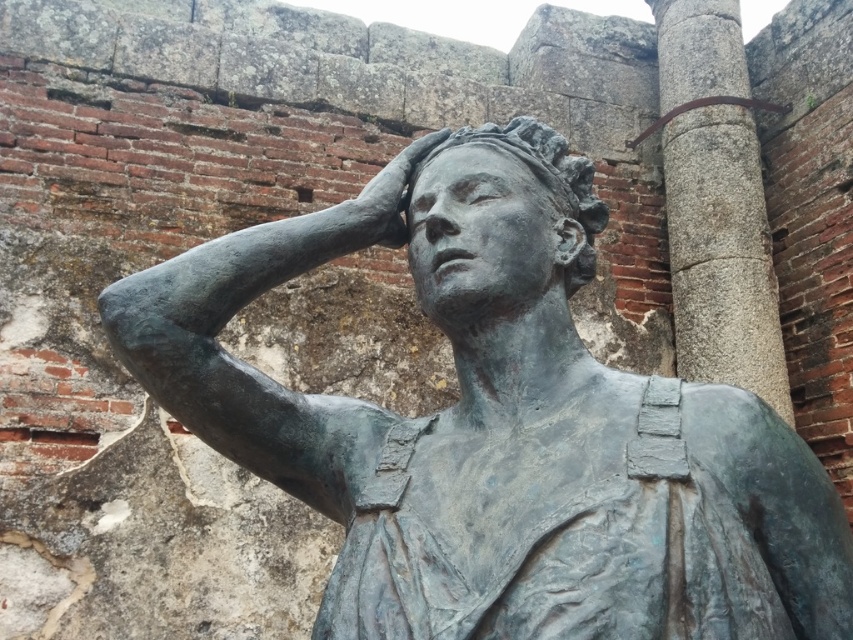
You are an art conservator examining the bronze statue at center and the bronze hand at center. According to the spatial arrangement, which object is positioned to the left?

The bronze hand at center is positioned to the left of the bronze statue at center.

You are standing at a point 14.85 feet away from the statue. The statue is located at coordinates point [485,134]. If you want to move closer to the statue, which direction should you move in relation to the statue?

Since you are 14.85 feet away from the statue at point [485,134], moving towards the statue would mean moving in the direction of the statue from your current position.